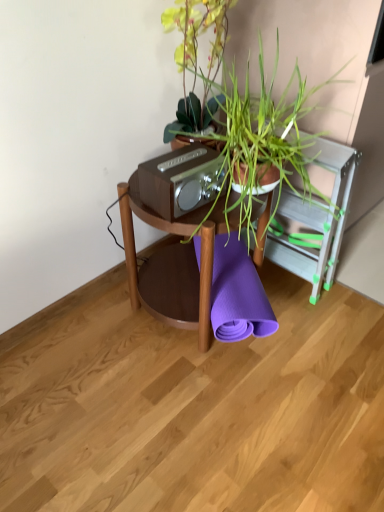
The height and width of the screenshot is (512, 384). In order to click on free space on the front side of woodenmaterial/texturetable at center in this screenshot , I will do (x=191, y=399).